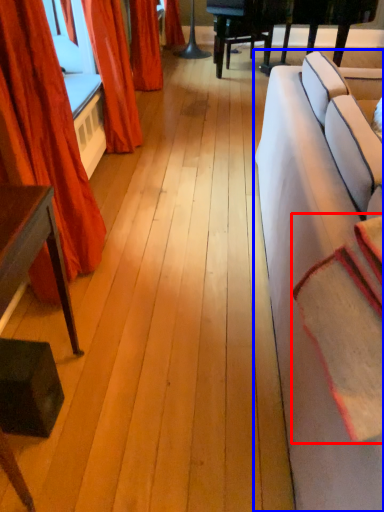
Question: Which point is closer to the camera, blanket (highlighted by a red box) or studio couch (highlighted by a blue box)?

Choices:
 (A) blanket
 (B) studio couch

Answer: (B)